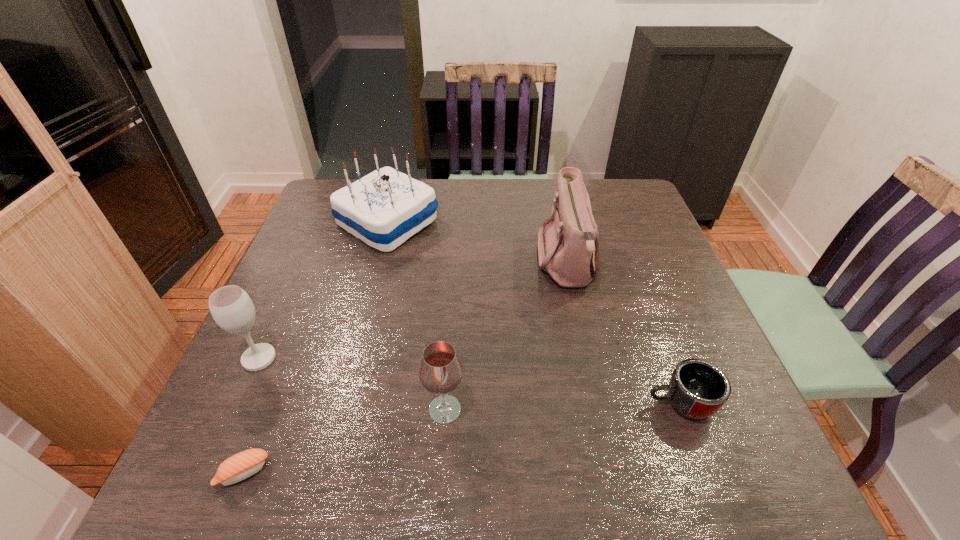
Image resolution: width=960 pixels, height=540 pixels. Find the location of `vacant region at the left edge`. vacant region at the left edge is located at coordinates pos(345,239).

Where is `blank area at the right edge`? The height and width of the screenshot is (540, 960). blank area at the right edge is located at coordinates (693, 340).

In the image, there is a desktop. Find the location of `free space at the far right corner`. free space at the far right corner is located at coordinates (632, 220).

Where is `vacant point located between the second object from right to left and the fourth object from left to right`? This screenshot has width=960, height=540. vacant point located between the second object from right to left and the fourth object from left to right is located at coordinates (506, 336).

Locate an element on the screen. vacant area that lies between the shoulder bag and the mug is located at coordinates (624, 333).

At what (x,y) coordinates should I click in order to perform the action: click on vacant area that lies between the farther wineglass and the fifth tallest object. Please return your answer as a coordinate pair (x, y). This screenshot has height=540, width=960. Looking at the image, I should click on (469, 381).

Where is `free space between the right wineglass and the second object from right to left`? free space between the right wineglass and the second object from right to left is located at coordinates (506, 336).

At what (x,y) coordinates should I click in order to perform the action: click on empty space between the rightmost object and the left wineglass. Please return your answer as a coordinate pair (x, y). The width and height of the screenshot is (960, 540). Looking at the image, I should click on (469, 381).

Locate an element on the screen. empty space that is in between the third object from right to left and the rightmost object is located at coordinates click(x=563, y=407).

Identify the location of vacant area between the farther wineglass and the fifth object from left to right. (413, 310).